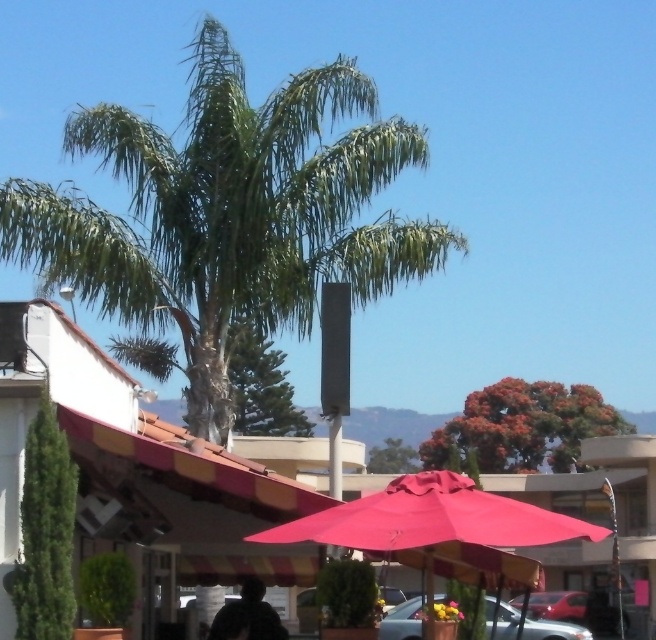
Does striped awning at center come in front of dark fabric silhouette at lower center?

No, striped awning at center is further to the viewer.

Looking at this image, is striped awning at center taller than dark fabric silhouette at lower center?

Yes, striped awning at center is taller than dark fabric silhouette at lower center.

Image resolution: width=656 pixels, height=640 pixels. I want to click on striped awning at center, so click(x=197, y=500).

Who is lower down, green leafy palm tree at center or dark fabric silhouette at lower center?

dark fabric silhouette at lower center is lower down.

Is point (45, 202) positioned before point (220, 637)?

No, it is not.

The height and width of the screenshot is (640, 656). Find the location of `green leafy palm tree at center`. green leafy palm tree at center is located at coordinates (228, 216).

Which of these two, green leafy palm tree at center or metallic silver car at lower center, stands taller?

green leafy palm tree at center

Can you confirm if green leafy palm tree at center is positioned to the left of metallic silver car at lower center?

Yes, green leafy palm tree at center is to the left of metallic silver car at lower center.

Which is in front, point (310, 93) or point (575, 624)?

Point (310, 93) is in front.

This screenshot has height=640, width=656. I want to click on green leafy palm tree at center, so click(228, 216).